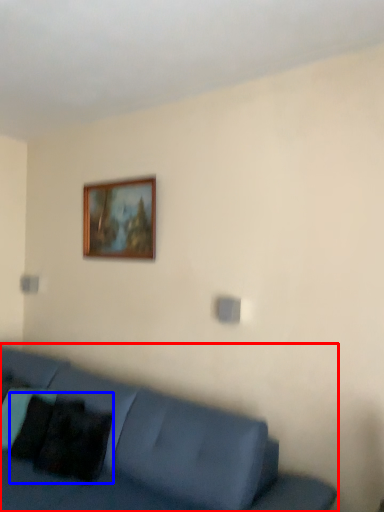
Question: Which object is further to the camera taking this photo, studio couch (highlighted by a red box) or pillow (highlighted by a blue box)?

Choices:
 (A) studio couch
 (B) pillow

Answer: (B)